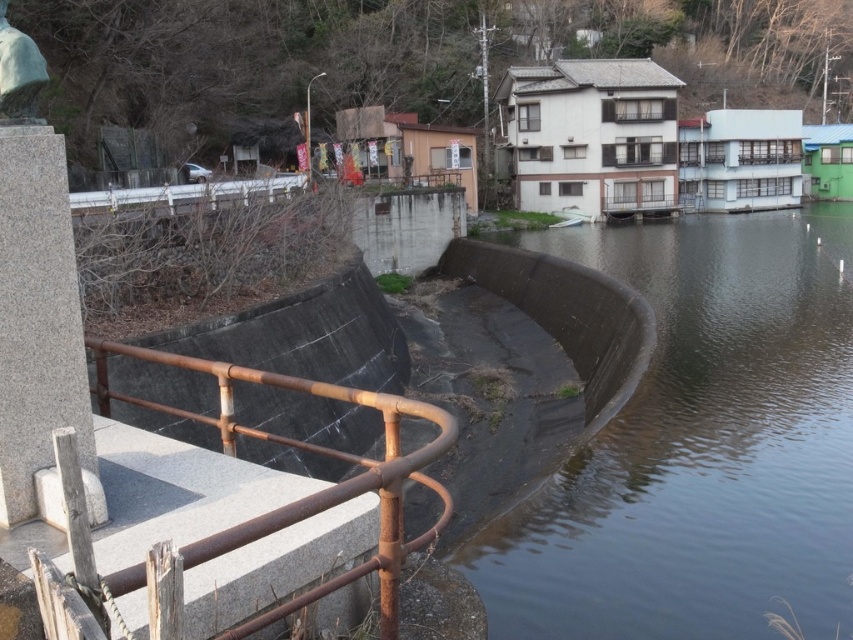
Question: Considering the relative positions of smooth concrete river at center right and green stone statue at upper left in the image provided, where is smooth concrete river at center right located with respect to green stone statue at upper left?

Choices:
 (A) right
 (B) left

Answer: (A)

Question: Where is rusty metal railing at lower left located in relation to green stone statue at upper left in the image?

Choices:
 (A) left
 (B) right

Answer: (A)

Question: Is rusty metal railing at lower left above green stone statue at upper left?

Choices:
 (A) no
 (B) yes

Answer: (A)

Question: Among these objects, which one is nearest to the camera?

Choices:
 (A) smooth concrete river at center right
 (B) green stone statue at upper left

Answer: (B)

Question: Which point is farther to the camera?

Choices:
 (A) smooth concrete river at center right
 (B) rusty metal railing at lower left
 (C) green stone statue at upper left

Answer: (B)

Question: Which point is closer to the camera?

Choices:
 (A) (196, 368)
 (B) (12, 76)

Answer: (B)